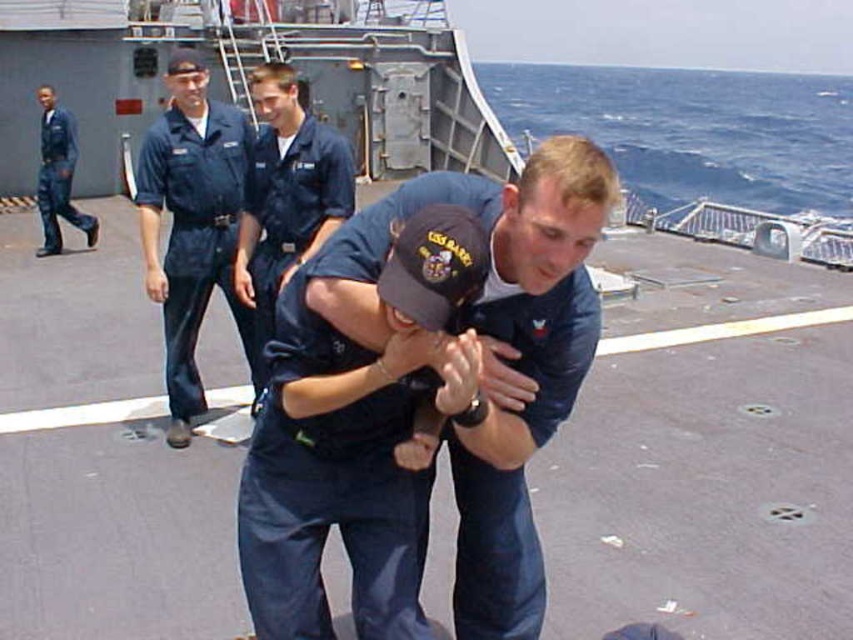
You are a crew member on the deck of a naval ship. You notice two crew members in navy blue uniform at center and blue uniform at left. Which one is closer to the edge of the deck?

The navy blue uniform at center is positioned under blue uniform at left, meaning it is closer to the edge of the deck.

You are a photographer on the deck of a naval ship. You need to position yourself so that both the navy blue uniform at center and the navy blue uniform at left are fully visible in your photo. Based on their positions, which side of the deck should you stand to capture both subjects without any overlap?

You should stand on the side opposite to where the navy blue uniform at center is located since the navy blue uniform at center might be wider than the navy blue uniform at left, allowing both to be captured without overlapping.